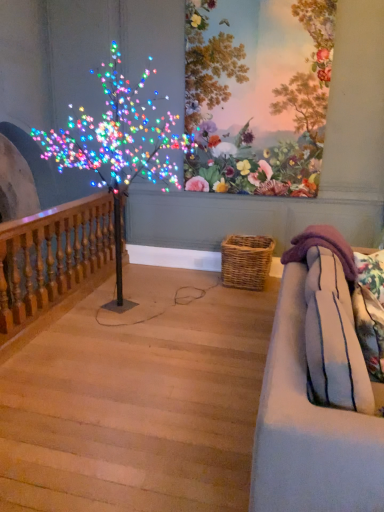
You are a GUI agent. You are given a task and a screenshot of the screen. Output one action in this format:
    pyautogui.click(x=<x>, y=<y>)
    Task: Click on the vacant area that lies in front of woven brown basket at lower center
    
    Given the screenshot: What is the action you would take?
    pyautogui.click(x=236, y=298)